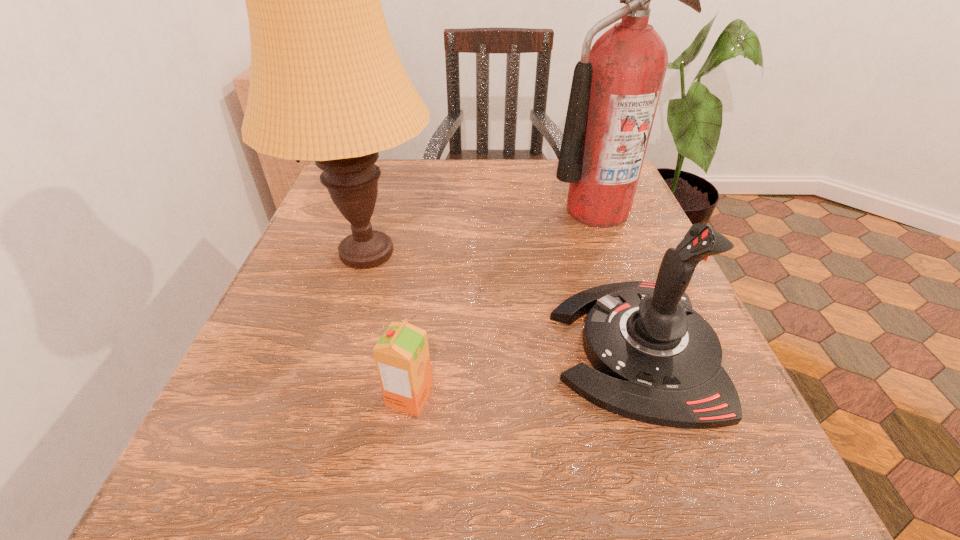
Where is `vacant space in between the lampshade and the fire extinguisher`? The height and width of the screenshot is (540, 960). vacant space in between the lampshade and the fire extinguisher is located at coordinates (482, 232).

Identify which object is located as the nearest to the shortest object. Please provide its 2D coordinates. Your answer should be formatted as a tuple, i.e. [(x, y)], where the tuple contains the x and y coordinates of a point satisfying the conditions above.

[(327, 85)]

Locate an element on the screen. object that is the third closest to the lampshade is located at coordinates (616, 86).

You are a GUI agent. You are given a task and a screenshot of the screen. Output one action in this format:
    pyautogui.click(x=<x>, y=<y>)
    Task: Click on the blank space that satisfies the following two spatial constraints: 1. on the front of the fire extinguisher near the operation label; 2. on the handle side of the joystick
    The width and height of the screenshot is (960, 540).
    Given the screenshot: What is the action you would take?
    pyautogui.click(x=647, y=348)

Where is `vacant space that satisfies the following two spatial constraints: 1. on the front of the fire extinguisher near the operation label; 2. on the handle side of the second shortest object`? The image size is (960, 540). vacant space that satisfies the following two spatial constraints: 1. on the front of the fire extinguisher near the operation label; 2. on the handle side of the second shortest object is located at coordinates (647, 348).